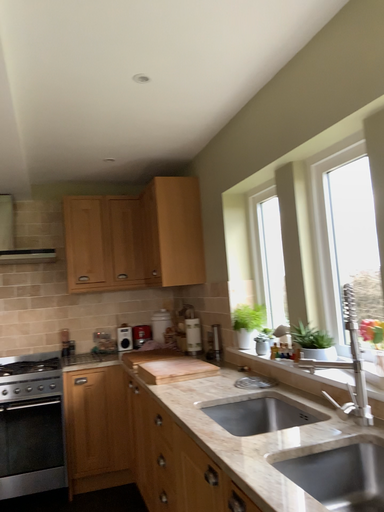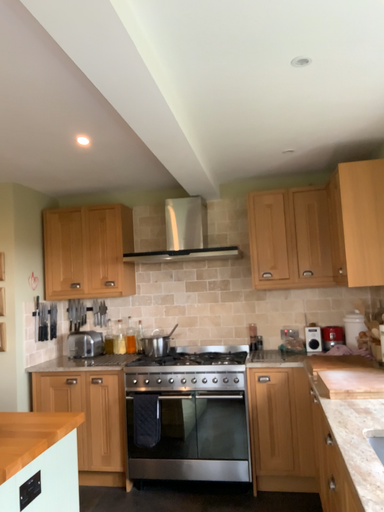
Question: How did the camera likely rotate when shooting the video?

Choices:
 (A) rotated left
 (B) rotated right

Answer: (A)